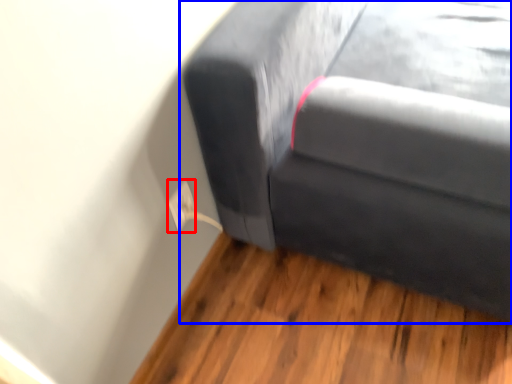
Question: Which of the following is the closest to the observer, electric outlet (highlighted by a red box) or studio couch (highlighted by a blue box)?

Choices:
 (A) electric outlet
 (B) studio couch

Answer: (B)